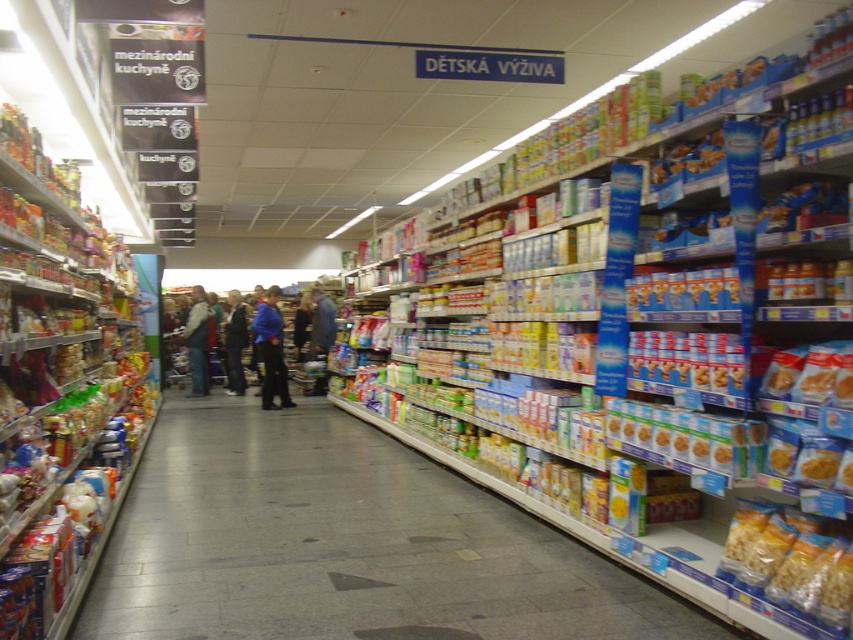
Question: Which of the following is the closest to the observer?

Choices:
 (A) denim jacket at center
 (B) translucent brown snack at lower right
 (C) light brown corduroy pants at center
 (D) blue fabric jacket at center

Answer: (B)

Question: Which object is closer to the camera taking this photo?

Choices:
 (A) matte brown snack at center right
 (B) dark blue jacket at center
 (C) matte plastic snacks at center
 (D) blue fabric jacket at center

Answer: (C)

Question: Does dark blue jacket at center appear on the right side of matte brown snack at center right?

Choices:
 (A) no
 (B) yes

Answer: (A)

Question: Does blue fabric pants at center appear on the right side of dark blue jacket at center?

Choices:
 (A) yes
 (B) no

Answer: (A)

Question: Does blue fabric jacket at center appear on the left side of dark blue jacket at center?

Choices:
 (A) no
 (B) yes

Answer: (A)

Question: Which object is closer to the camera taking this photo?

Choices:
 (A) translucent brown snack at lower right
 (B) matte brown snack at center right
 (C) blue fabric pants at center

Answer: (A)